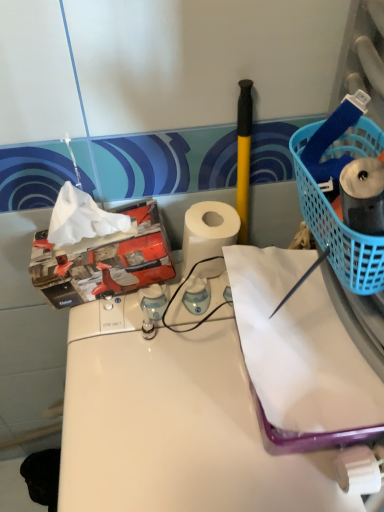
Question: Considering the relative sizes of blue plastic basket at right and white matte paper at center in the image provided, is blue plastic basket at right taller than white matte paper at center?

Choices:
 (A) no
 (B) yes

Answer: (A)

Question: Considering the relative sizes of blue plastic basket at right and white matte paper at center in the image provided, is blue plastic basket at right shorter than white matte paper at center?

Choices:
 (A) no
 (B) yes

Answer: (B)

Question: Are blue plastic basket at right and white matte paper at center beside each other?

Choices:
 (A) yes
 (B) no

Answer: (B)

Question: Does blue plastic basket at right have a lesser width compared to white matte paper at center?

Choices:
 (A) yes
 (B) no

Answer: (A)

Question: Is there a large distance between blue plastic basket at right and white matte paper at center?

Choices:
 (A) yes
 (B) no

Answer: (B)

Question: Considering the positions of white glossy counter at center and white matte paper at center in the image, is white glossy counter at center wider or thinner than white matte paper at center?

Choices:
 (A) thin
 (B) wide

Answer: (B)

Question: Is white glossy counter at center in front of or behind white matte paper at center in the image?

Choices:
 (A) behind
 (B) front

Answer: (B)

Question: Does point (228, 458) appear closer or farther from the camera than point (311, 321)?

Choices:
 (A) farther
 (B) closer

Answer: (B)

Question: In terms of size, does white glossy counter at center appear bigger or smaller than white matte paper at center?

Choices:
 (A) big
 (B) small

Answer: (A)

Question: From a real-world perspective, is white matte paper towel at center physically located above or below white glossy counter at center?

Choices:
 (A) below
 (B) above

Answer: (B)

Question: Is white matte paper towel at center spatially inside white glossy counter at center, or outside of it?

Choices:
 (A) outside
 (B) inside

Answer: (A)

Question: In terms of size, does white matte paper towel at center appear bigger or smaller than white glossy counter at center?

Choices:
 (A) small
 (B) big

Answer: (A)

Question: Is white matte paper towel at center wider or thinner than white glossy counter at center?

Choices:
 (A) wide
 (B) thin

Answer: (B)

Question: Would you say white glossy counter at center is inside or outside white matte paper towel at center?

Choices:
 (A) outside
 (B) inside

Answer: (A)

Question: Is white glossy counter at center wider or thinner than white matte paper towel at center?

Choices:
 (A) wide
 (B) thin

Answer: (A)